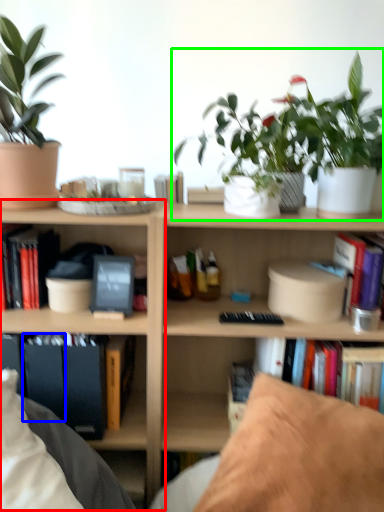
Question: Which object is the closest to the shelf (highlighted by a red box)? Choose among these: paperback book (highlighted by a blue box) or houseplant (highlighted by a green box).

Choices:
 (A) paperback book
 (B) houseplant

Answer: (A)